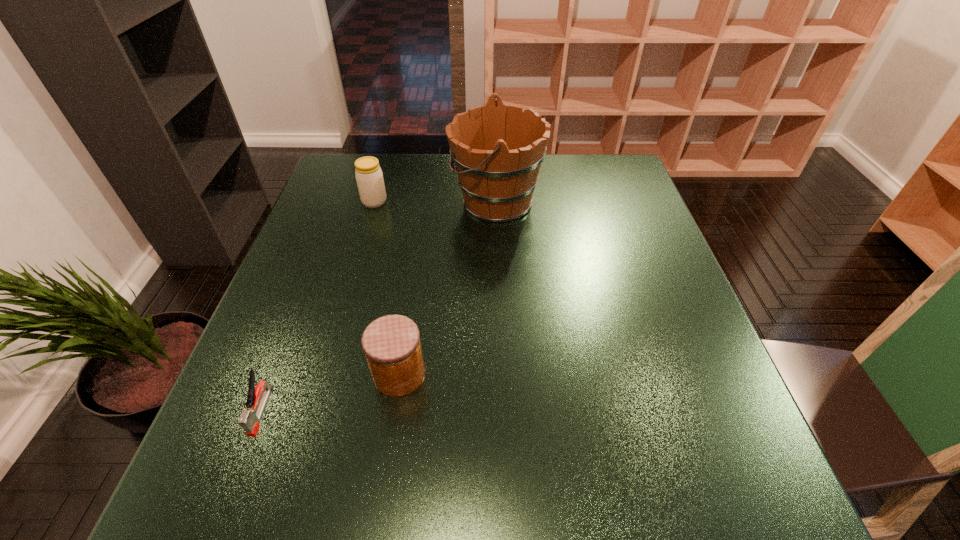
You are a GUI agent. You are given a task and a screenshot of the screen. Output one action in this format:
    pyautogui.click(x=<x>, y=<y>)
    Task: Click on the free space between the rightmost object and the left jar
    This screenshot has height=540, width=960.
    Given the screenshot: What is the action you would take?
    pyautogui.click(x=435, y=201)

The height and width of the screenshot is (540, 960). Find the location of `free spot between the right jar and the farther jar`. free spot between the right jar and the farther jar is located at coordinates (387, 288).

You are a GUI agent. You are given a task and a screenshot of the screen. Output one action in this format:
    pyautogui.click(x=<x>, y=<y>)
    Task: Click on the free area in between the leftmost object and the nearer jar
    Image resolution: width=960 pixels, height=540 pixels.
    Given the screenshot: What is the action you would take?
    pyautogui.click(x=330, y=393)

In order to click on empty location between the tallest object and the second object from right to left in this screenshot , I will do [x=447, y=288].

This screenshot has height=540, width=960. What are the coordinates of `unoccupied position between the farther jar and the shortest object` in the screenshot? It's located at (318, 306).

In order to click on the third closest object to the farther jar in this screenshot , I will do `click(250, 418)`.

Find the location of a particular element. The width and height of the screenshot is (960, 540). the second closest object to the rightmost object is located at coordinates (391, 343).

I want to click on vacant space that satisfies the following two spatial constraints: 1. with the handle on the tallest object; 2. on the handle side of the stapler, so click(505, 410).

Find the location of a particular element. The image size is (960, 540). free location that satisfies the following two spatial constraints: 1. with the handle on the tallest object; 2. on the handle side of the leftmost object is located at coordinates (505, 410).